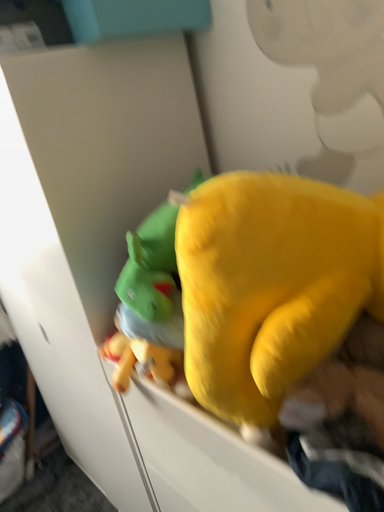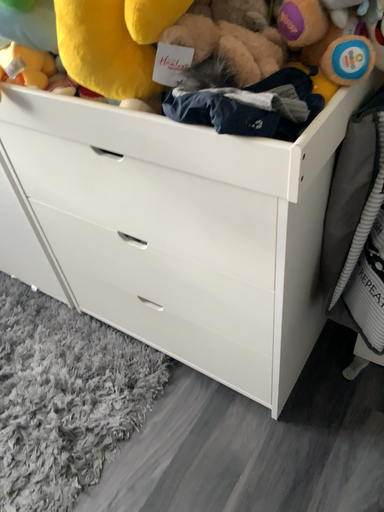
Question: Which way did the camera rotate in the video?

Choices:
 (A) rotated right
 (B) rotated left

Answer: (A)